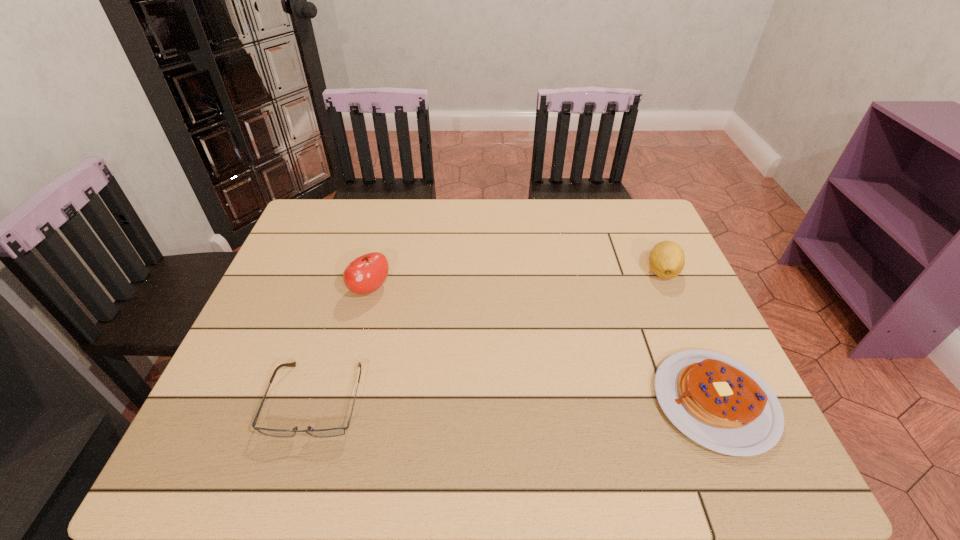
This screenshot has width=960, height=540. In order to click on vacant area that lies between the pancake and the second tallest object in this screenshot , I will do `click(688, 336)`.

What are the coordinates of `free space between the apple and the lemon` in the screenshot? It's located at (516, 280).

Where is `free spot between the pancake and the spectacles`? free spot between the pancake and the spectacles is located at coordinates (516, 401).

Locate which object is the third closest to the apple. Please provide its 2D coordinates. Your answer should be formatted as a tuple, i.e. [(x, y)], where the tuple contains the x and y coordinates of a point satisfying the conditions above.

[(666, 259)]

The image size is (960, 540). I want to click on object that is the second closest to the apple, so click(x=718, y=402).

At what (x,y) coordinates should I click in order to perform the action: click on free space that satisfies the following two spatial constraints: 1. on the back side of the lemon; 2. on the left side of the tallest object. Please return your answer as a coordinate pair (x, y). The image size is (960, 540). Looking at the image, I should click on (375, 271).

Where is `free spot that satisfies the following two spatial constraints: 1. on the back side of the pancake; 2. on the left side of the lemon`? The height and width of the screenshot is (540, 960). free spot that satisfies the following two spatial constraints: 1. on the back side of the pancake; 2. on the left side of the lemon is located at coordinates (658, 271).

Find the location of a particular element. This screenshot has width=960, height=540. vacant position in the image that satisfies the following two spatial constraints: 1. on the back side of the apple; 2. on the right side of the lemon is located at coordinates (375, 271).

Identify the location of free point that satisfies the following two spatial constraints: 1. on the front-facing side of the pancake; 2. on the left side of the shortest object. The height and width of the screenshot is (540, 960). (317, 401).